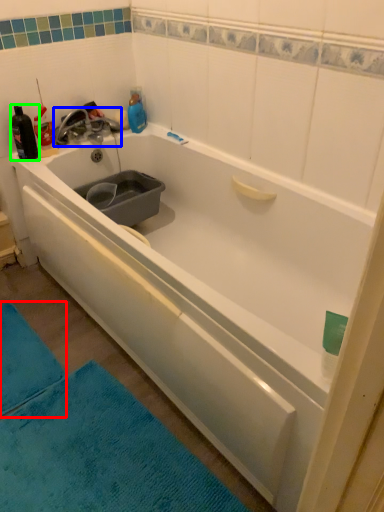
Question: Based on their relative distances, which object is nearer to bath mat (highlighted by a red box)? Choose from tap (highlighted by a blue box) and bottle (highlighted by a green box).

Choices:
 (A) tap
 (B) bottle

Answer: (B)